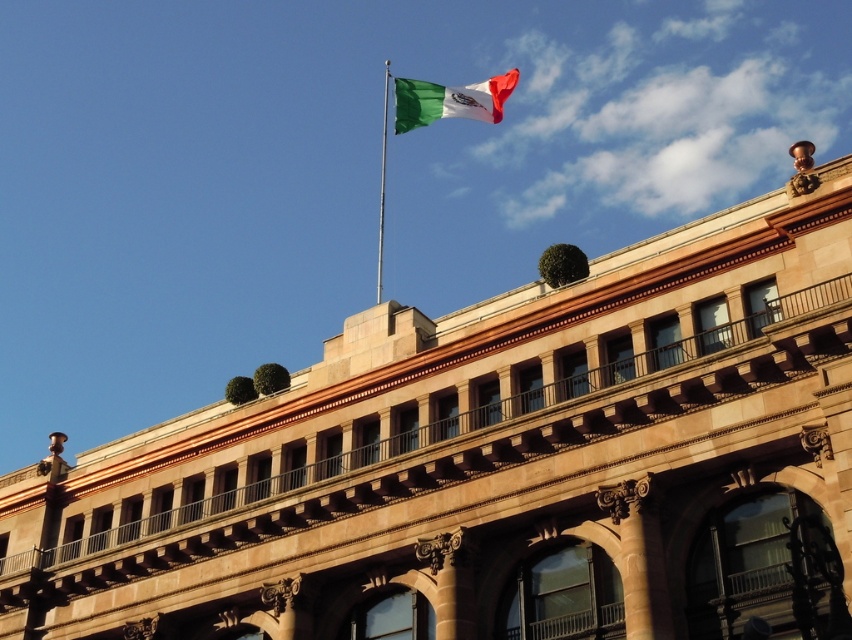
You are standing 50 meters away from the grand classical building. The flagpole with the green and white fabric flag at upper center is part of the building. Can you safely walk closer to the flagpole without getting too near to it?

The distance between you and the green and white fabric flag at upper center is 65.80 meters, so walking 50 meters closer would bring you to 15.80 meters away. Since this is still a safe distance, you can approach closer without being too near.

You are standing in front of the classical building and notice two points marked on the facade. The first point is at coordinate (450, 112) and the second at (381, 282). Based on their positions, which point is closer to you?

Point (450, 112) is in front of point (381, 282), so it is closer to you.